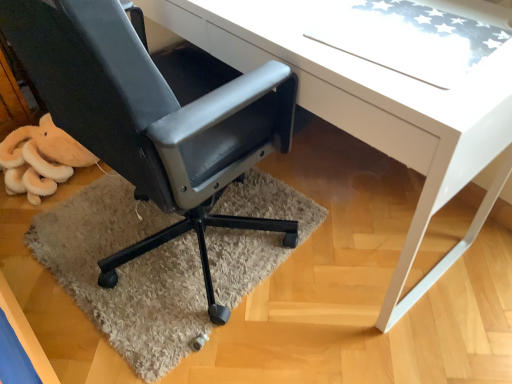
Question: Is matte black office chair at lower left wider than white glossy desk at center?

Choices:
 (A) no
 (B) yes

Answer: (B)

Question: Would you say matte black office chair at lower left is a long distance from white glossy desk at center?

Choices:
 (A) yes
 (B) no

Answer: (B)

Question: Does matte black office chair at lower left come in front of white glossy desk at center?

Choices:
 (A) no
 (B) yes

Answer: (B)

Question: Is white glossy desk at center located within matte black office chair at lower left?

Choices:
 (A) yes
 (B) no

Answer: (B)

Question: Is matte black office chair at lower left taller than white glossy desk at center?

Choices:
 (A) no
 (B) yes

Answer: (B)

Question: From the image's perspective, is matte black office chair at lower left located above white glossy desk at center?

Choices:
 (A) yes
 (B) no

Answer: (B)

Question: From the image's perspective, does beige shaggy rug at lower left appear lower than matte black office chair at lower left?

Choices:
 (A) yes
 (B) no

Answer: (A)

Question: Is beige shaggy rug at lower left not within matte black office chair at lower left?

Choices:
 (A) no
 (B) yes

Answer: (B)

Question: Considering the relative sizes of beige shaggy rug at lower left and matte black office chair at lower left in the image provided, is beige shaggy rug at lower left taller than matte black office chair at lower left?

Choices:
 (A) yes
 (B) no

Answer: (B)

Question: Is matte black office chair at lower left inside beige shaggy rug at lower left?

Choices:
 (A) yes
 (B) no

Answer: (B)

Question: From the image's perspective, is beige shaggy rug at lower left on matte black office chair at lower left?

Choices:
 (A) no
 (B) yes

Answer: (A)

Question: Could you tell me if beige shaggy rug at lower left is turned towards matte black office chair at lower left?

Choices:
 (A) no
 (B) yes

Answer: (A)

Question: Can you confirm if white glossy desk at center is smaller than matte black office chair at lower left?

Choices:
 (A) yes
 (B) no

Answer: (B)